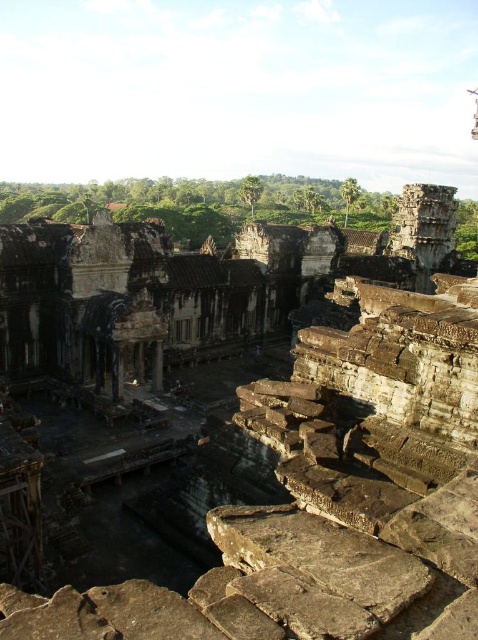
Can you confirm if brown stone ruins at center is thinner than brown stone pillar at center?

Incorrect, brown stone ruins at center's width is not less than brown stone pillar at center's.

Between brown stone ruins at center and brown stone pillar at center, which one has less height?

With less height is brown stone pillar at center.

Consider the image. Measure the distance between brown stone ruins at center and camera.

A distance of 25.84 meters exists between brown stone ruins at center and camera.

Where is `brown stone ruins at center`? The height and width of the screenshot is (640, 478). brown stone ruins at center is located at coordinates (274, 426).